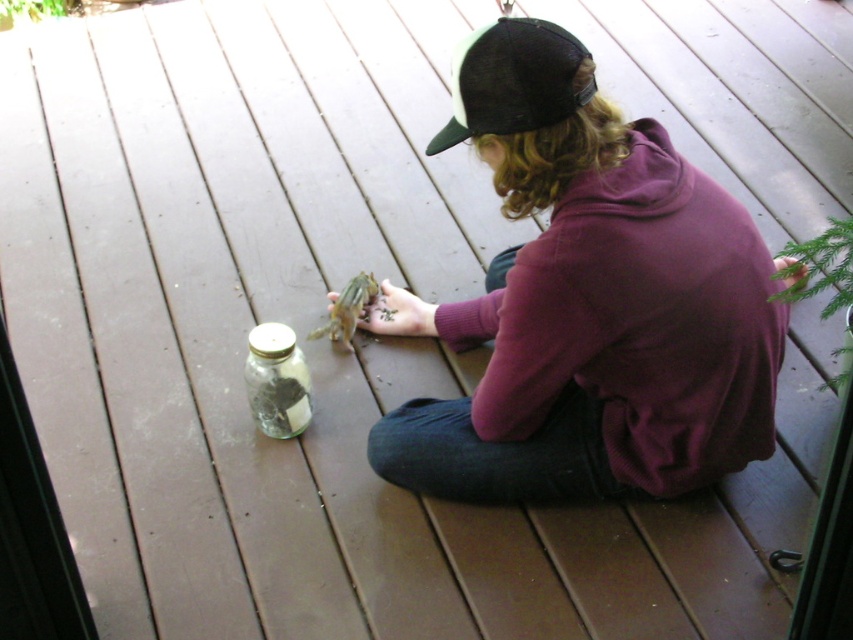
Question: Which object is positioned farthest from the clear glass jar at center?

Choices:
 (A) green matte chipmunk at center
 (B) purple fleece sweatshirt at center

Answer: (B)

Question: Which of these objects is positioned closest to the purple fleece sweatshirt at center?

Choices:
 (A) black leather cap at upper center
 (B) green matte chipmunk at center

Answer: (A)

Question: Is purple fleece sweatshirt at center in front of clear glass jar at center?

Choices:
 (A) yes
 (B) no

Answer: (A)

Question: Is black leather cap at upper center further to camera compared to clear glass jar at center?

Choices:
 (A) yes
 (B) no

Answer: (B)

Question: Among these points, which one is farthest from the camera?

Choices:
 (A) (770, 323)
 (B) (369, 289)
 (C) (300, 413)
 (D) (461, 138)

Answer: (B)

Question: Is purple fleece sweatshirt at center positioned at the back of clear glass jar at center?

Choices:
 (A) yes
 (B) no

Answer: (B)